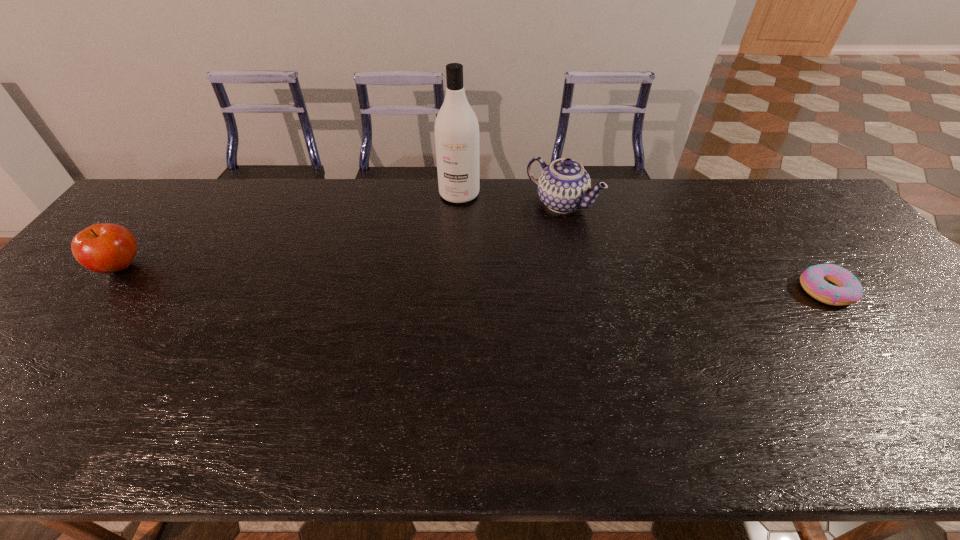
Where is `free spot on the desktop that is between the third tallest object and the rightmost object and is positioned at the spout of the chinaware`? The height and width of the screenshot is (540, 960). free spot on the desktop that is between the third tallest object and the rightmost object and is positioned at the spout of the chinaware is located at coordinates (473, 279).

I want to click on vacant spot on the desktop that is between the second shortest object and the shortest object and is positioned on the front-facing side of the third object from right to left, so pyautogui.click(x=428, y=277).